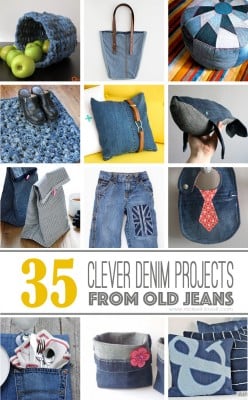
The image size is (248, 400). What are the coordinates of `basket` in the screenshot? It's located at (122, 359), (60, 25).